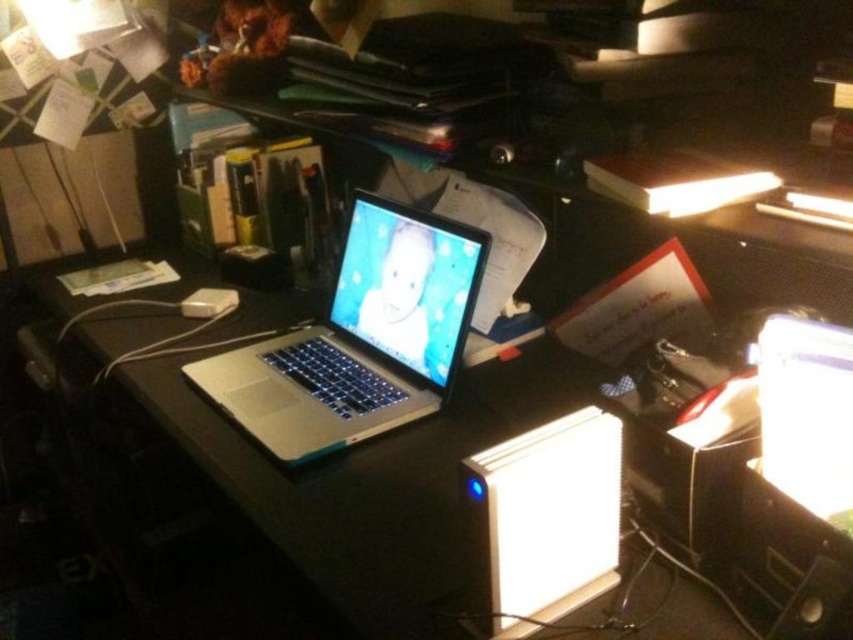
Question: Does silver metallic laptop at center have a greater width compared to white plastic external hard drive at center?

Choices:
 (A) no
 (B) yes

Answer: (B)

Question: Among these objects, which one is nearest to the camera?

Choices:
 (A) silver metallic laptop at center
 (B) white plastic external hard drive at center

Answer: (B)

Question: Does silver metallic laptop at center appear over white plastic external hard drive at center?

Choices:
 (A) yes
 (B) no

Answer: (A)

Question: Where is silver metallic laptop at center located in relation to white plastic external hard drive at center in the image?

Choices:
 (A) below
 (B) above

Answer: (B)